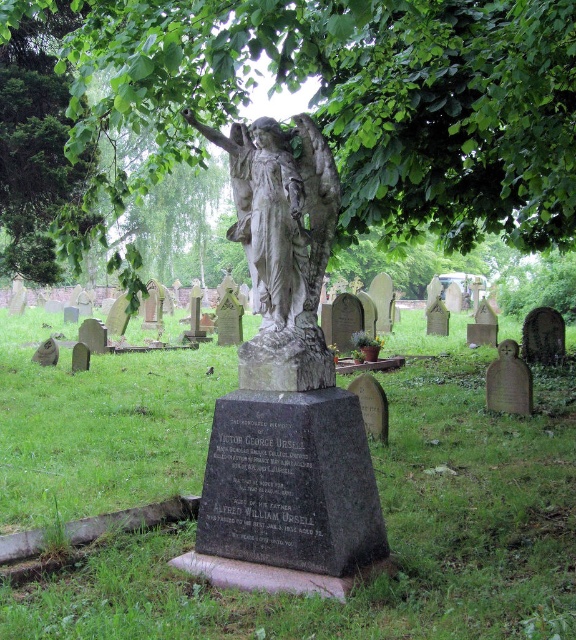
Between point (183, 36) and point (270, 193), which one is positioned in front?

Point (270, 193) is more forward.

Which of these two, green leafy tree at center or white stone statue at center, stands shorter?

With less height is green leafy tree at center.

Which is behind, point (426, 61) or point (282, 236)?

The point (426, 61) is behind.

Locate an element on the screen. The image size is (576, 640). green leafy tree at center is located at coordinates (355, 99).

Looking at this image, is white stone statue at center smaller than smooth gray stone at lower right?

Incorrect, white stone statue at center is not smaller in size than smooth gray stone at lower right.

Is white stone statue at center thinner than smooth gray stone at lower right?

No.

Is point (295, 244) farther from viewer compared to point (507, 408)?

No, it is not.

This screenshot has width=576, height=640. Find the location of `white stone statue at center`. white stone statue at center is located at coordinates (282, 246).

Who is higher up, green leafy tree at center or smooth gray stone at lower right?

green leafy tree at center

Can you confirm if green leafy tree at center is smaller than smooth gray stone at lower right?

No, green leafy tree at center is not smaller than smooth gray stone at lower right.

Is point (517, 136) positioned in front of point (495, 372)?

Yes, it is.

In order to click on green leafy tree at center in this screenshot , I will do `click(355, 99)`.